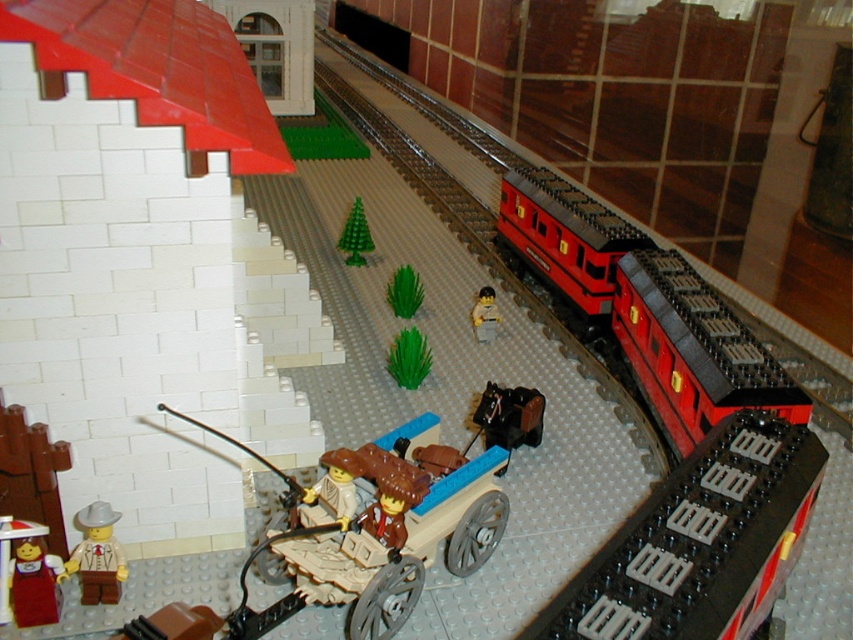
You are a Lego enthusiast examining the diorama. You notice the smooth plastic train at center and the green matte plant at center. Which object is larger in size?

The smooth plastic train at center is bigger than the green matte plant at center.

You are a Lego enthusiast trying to build a similar scene. You have both the green plastic tree at center and the smooth plastic minifigure at center. Which object should you place first to ensure proper scaling in your diorama?

You should place the green plastic tree at center first since it is larger in size than the smooth plastic minifigure at center, ensuring proper scaling by starting with the bigger element.

You are a Lego minifigure standing at the edge of the gray Lego baseplate. You want to reach the black horse cart. Which direction should you walk to avoid the green plastic tree at center?

The green plastic tree at center is located at coordinates point (355, 236). To avoid it while moving towards the black horse cart, you should walk around it either to the left or right side of the tree.